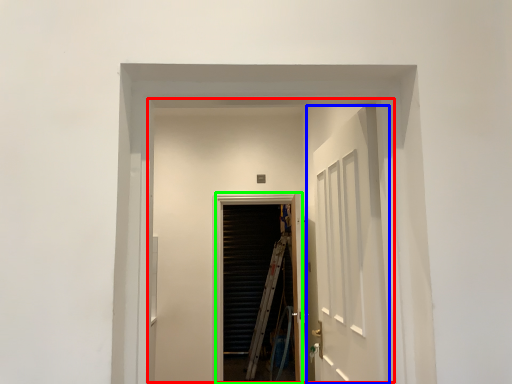
Question: Which object is positioned farthest from elevator (highlighted by a red box)? Select from door (highlighted by a blue box) and screen door (highlighted by a green box).

Choices:
 (A) door
 (B) screen door

Answer: (A)